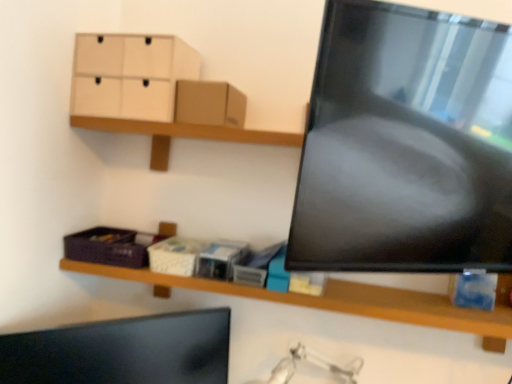
Question: From the image's perspective, is wooden shelf at lower center located above matte black monitor at lower left?

Choices:
 (A) no
 (B) yes

Answer: (B)

Question: Considering the relative sizes of wooden shelf at lower center and matte black monitor at lower left in the image provided, is wooden shelf at lower center thinner than matte black monitor at lower left?

Choices:
 (A) no
 (B) yes

Answer: (A)

Question: From the image's perspective, is wooden shelf at lower center located beneath matte black monitor at lower left?

Choices:
 (A) yes
 (B) no

Answer: (B)

Question: Is wooden shelf at lower center facing towards matte black monitor at lower left?

Choices:
 (A) no
 (B) yes

Answer: (A)

Question: From a real-world perspective, is wooden shelf at lower center positioned under matte black monitor at lower left based on gravity?

Choices:
 (A) yes
 (B) no

Answer: (B)

Question: From the image's perspective, is white matte storage box at center, acting as the 3th storage box starting from the left, above or below matte black monitor at lower left?

Choices:
 (A) below
 (B) above

Answer: (B)

Question: From a real-world perspective, is white matte storage box at center, acting as the 3th storage box starting from the left, physically located above or below matte black monitor at lower left?

Choices:
 (A) below
 (B) above

Answer: (B)

Question: Is white matte storage box at center, acting as the 3th storage box starting from the left, inside or outside of matte black monitor at lower left?

Choices:
 (A) inside
 (B) outside

Answer: (B)

Question: Is white matte storage box at center, acting as the 3th storage box starting from the left, wider or thinner than matte black monitor at lower left?

Choices:
 (A) wide
 (B) thin

Answer: (A)

Question: Considering the positions of light beige cardboard drawer at upper left and white cardboard tissue box at center, which is the second storage box from right to left, in the image, is light beige cardboard drawer at upper left wider or thinner than white cardboard tissue box at center, which is the second storage box from right to left,?

Choices:
 (A) thin
 (B) wide

Answer: (B)

Question: From a real-world perspective, is light beige cardboard drawer at upper left positioned above or below white cardboard tissue box at center, which is the second storage box from right to left?

Choices:
 (A) below
 (B) above

Answer: (B)

Question: Choose the correct answer: Is light beige cardboard drawer at upper left inside white cardboard tissue box at center, which is the second storage box from right to left, or outside it?

Choices:
 (A) outside
 (B) inside

Answer: (A)

Question: Is point (158, 46) positioned closer to the camera than point (165, 264)?

Choices:
 (A) farther
 (B) closer

Answer: (B)

Question: Would you say brown cardboard box at upper center is to the left or to the right of purple woven basket at lower left, the third storage box when ordered from right to left, in the picture?

Choices:
 (A) left
 (B) right

Answer: (B)

Question: From a real-world perspective, is brown cardboard box at upper center above or below purple woven basket at lower left, the first storage box viewed from the left?

Choices:
 (A) below
 (B) above

Answer: (B)